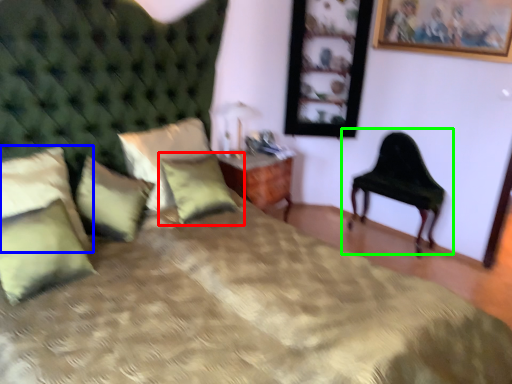
Question: Based on their relative distances, which object is farther from pillow (highlighted by a red box)? Choose from pillow (highlighted by a blue box) and chair (highlighted by a green box).

Choices:
 (A) pillow
 (B) chair

Answer: (B)